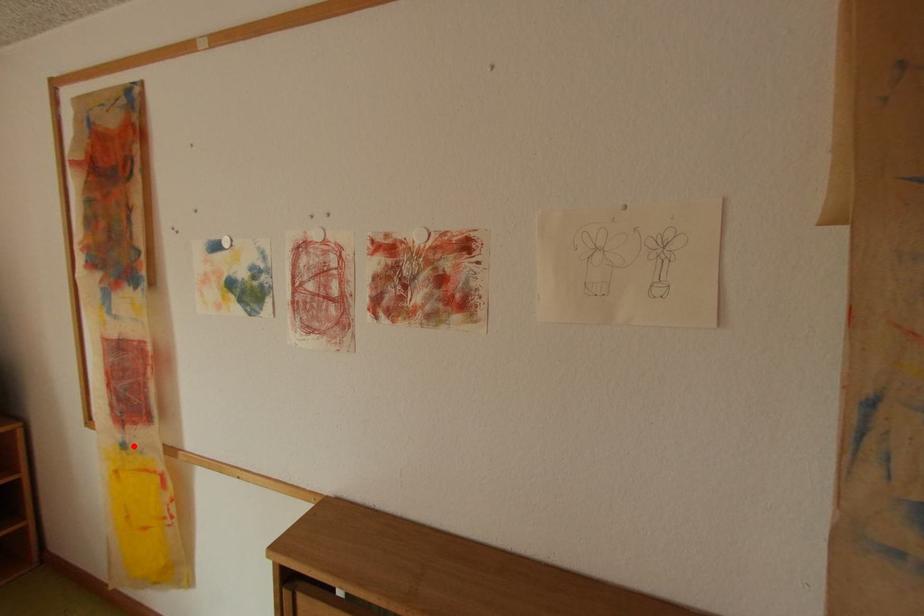
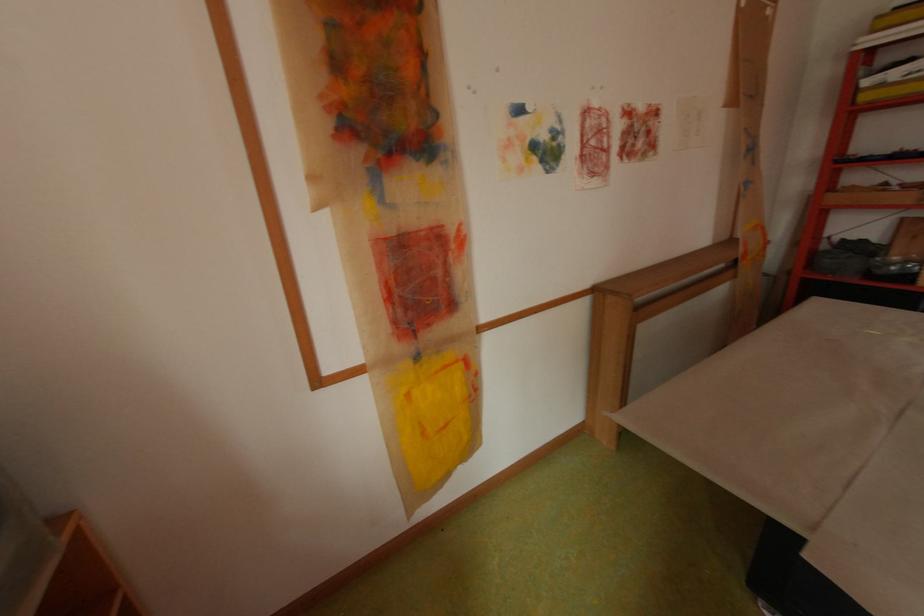
In the second image, find the point that corresponds to the highlighted location in the first image.

(429, 358)